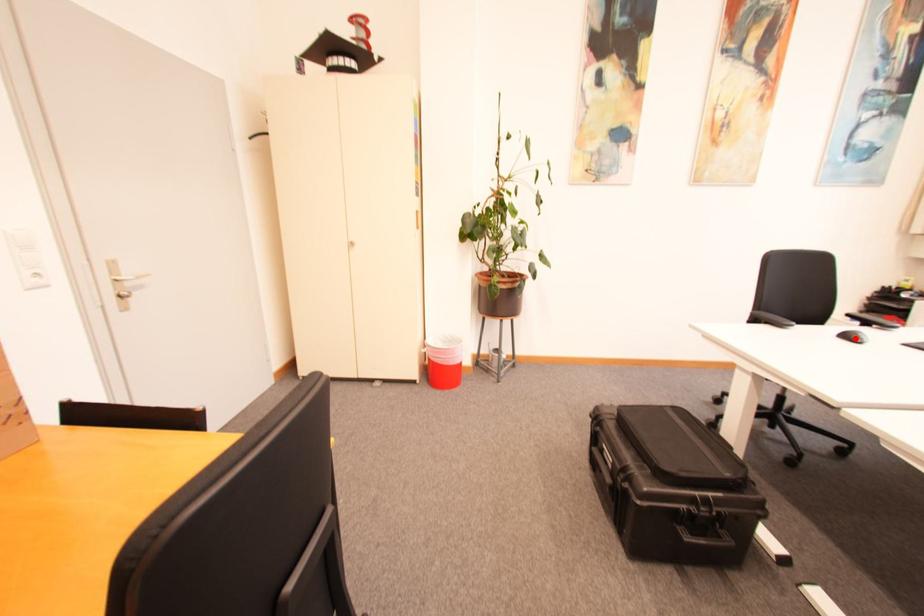
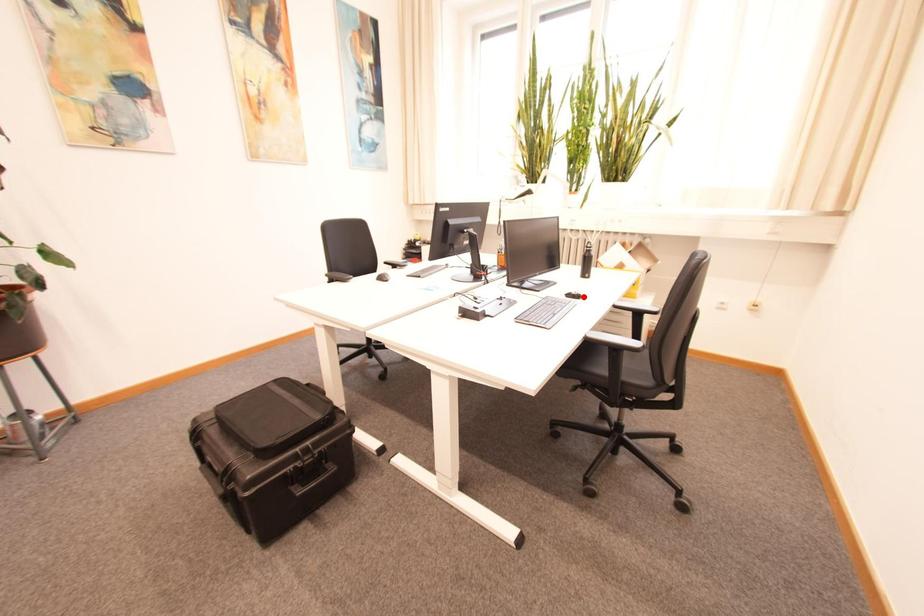
I am providing you with two images of the same scene from different viewpoints. A red point is marked on the first image and another point is marked on the second image. Is the red point in image1 aligned with the point shown in image2?

No